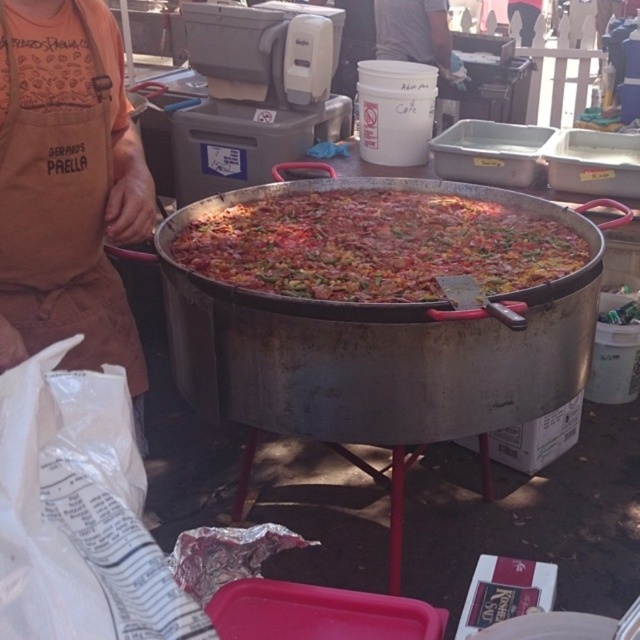
You are a customer at the food market and want to know if the brown apron at left is wider than the multicolored rice at center. Can you confirm?

The brown apron at left is thinner than the multicolored rice at center, so it is not wider.

You are standing in front of the paella pan and want to take a photo. There are two points marked in the image, point (28, 323) and point (244, 224). Which point will appear closer to the top edge of your photo?

Point (28, 323) is closer to the camera than point (244, 224), so it will appear closer to the top edge of your photo.